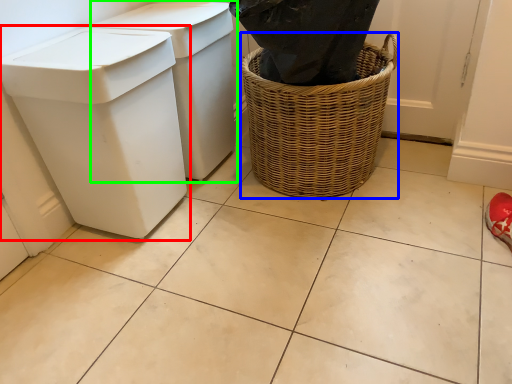
Question: Which is nearer to the waste container (highlighted by a red box)? basket container (highlighted by a blue box) or waste container (highlighted by a green box).

Choices:
 (A) basket container
 (B) waste container

Answer: (B)